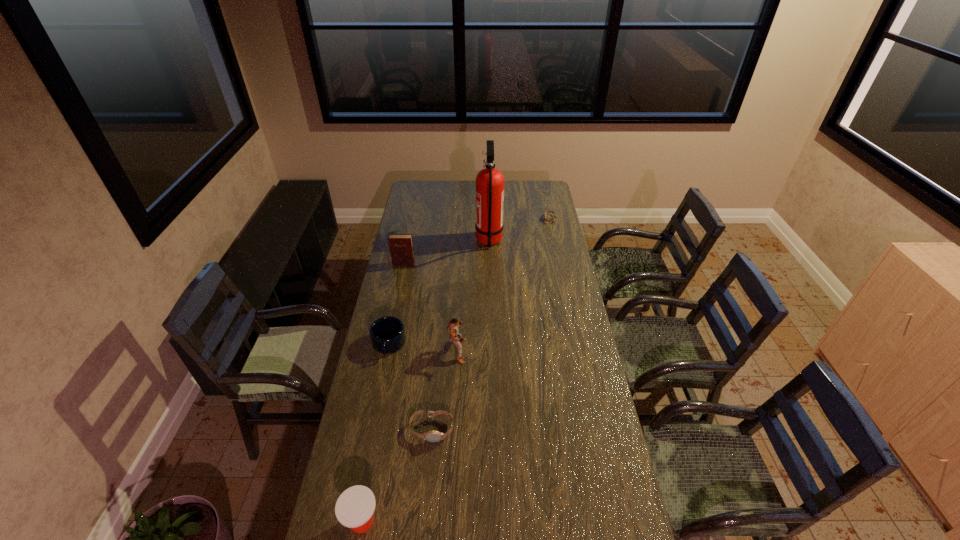
The image size is (960, 540). I want to click on mug that is at the left edge, so click(x=387, y=334).

Where is `object positioned at the right edge`? Image resolution: width=960 pixels, height=540 pixels. object positioned at the right edge is located at coordinates (548, 211).

This screenshot has width=960, height=540. I want to click on vacant space at the left edge of the desktop, so click(x=409, y=350).

Identify the location of free spot at the right edge of the desktop. (578, 304).

In the image, there is a desktop. What are the coordinates of `blank space at the far left corner` in the screenshot? It's located at (422, 188).

I want to click on vacant space at the far right corner of the desktop, so [x=536, y=181].

Find the location of `free space that is in between the sixth object from left to right and the third farthest object`. free space that is in between the sixth object from left to right and the third farthest object is located at coordinates (446, 252).

Identify the location of free area in between the mug and the puncher. (423, 348).

At what (x,y) coordinates should I click in order to perform the action: click on free space that is in between the shorter watch and the puncher. Please return your answer as a coordinate pair (x, y). This screenshot has height=540, width=960. Looking at the image, I should click on (504, 285).

Identify the location of free space between the tallest object and the puncher. The image size is (960, 540). (473, 296).